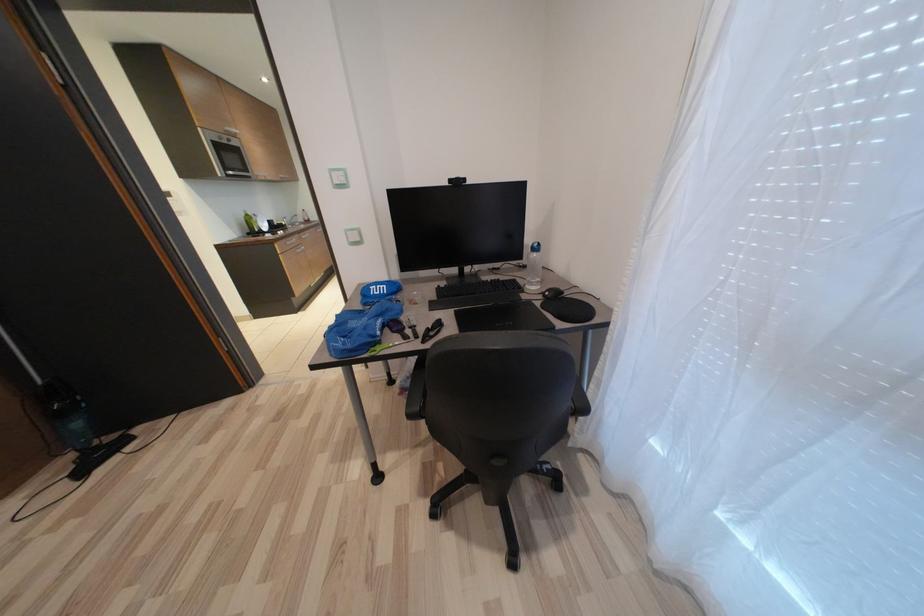
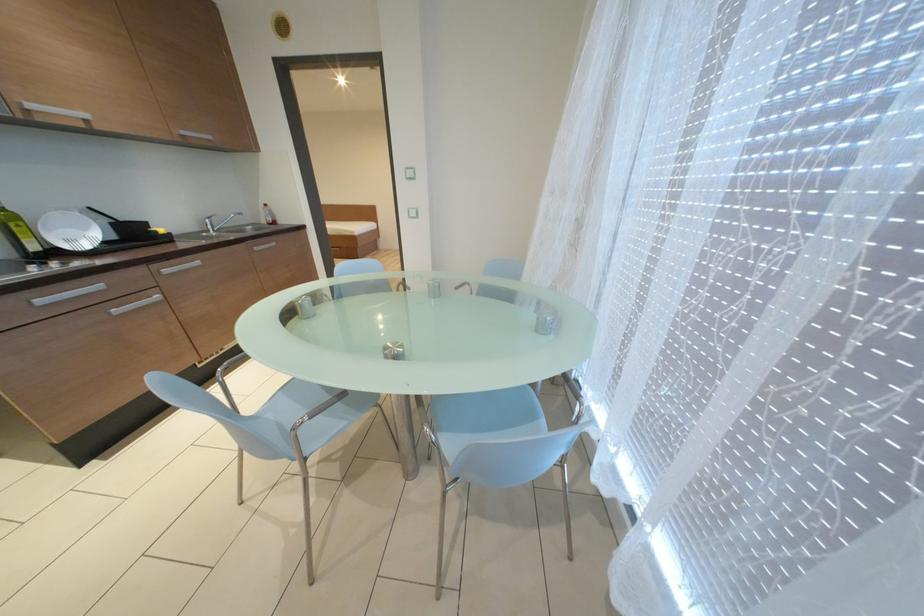
Question: Which direction would the cameraman need to move to produce the second image? Reply with the corresponding letter.

Choices:
 (A) Left
 (B) Right
 (C) Forward
 (D) Backward

Answer: (C)